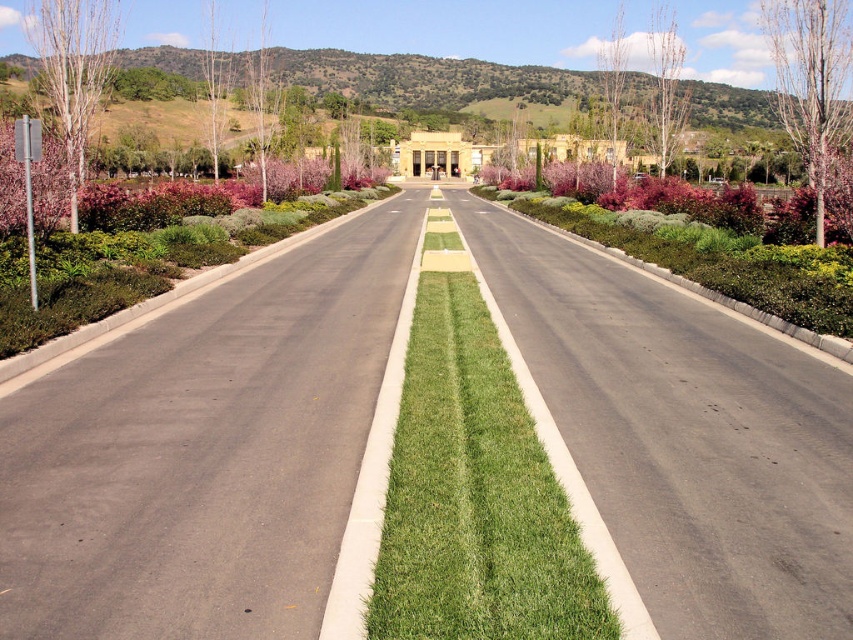
Question: Which point is closer to the camera taking this photo?

Choices:
 (A) (88, 104)
 (B) (611, 77)

Answer: (A)

Question: Which object is positioned farthest from the bare branches at upper right?

Choices:
 (A) smooth white tree at left
 (B) bare bark tree at upper center
 (C) green lawn at center
 (D) bare white tree at upper left

Answer: (A)

Question: Is smooth white tree at left below bare bark tree at upper center?

Choices:
 (A) yes
 (B) no

Answer: (B)

Question: Can you confirm if bare bark tree at upper right is positioned above bare white tree at upper left?

Choices:
 (A) yes
 (B) no

Answer: (B)

Question: Where is green lawn at center located in relation to bare white tree at upper left in the image?

Choices:
 (A) below
 (B) above

Answer: (A)

Question: Which of the following is the closest to the observer?

Choices:
 (A) (790, 118)
 (B) (74, 154)
 (C) (666, 10)

Answer: (B)